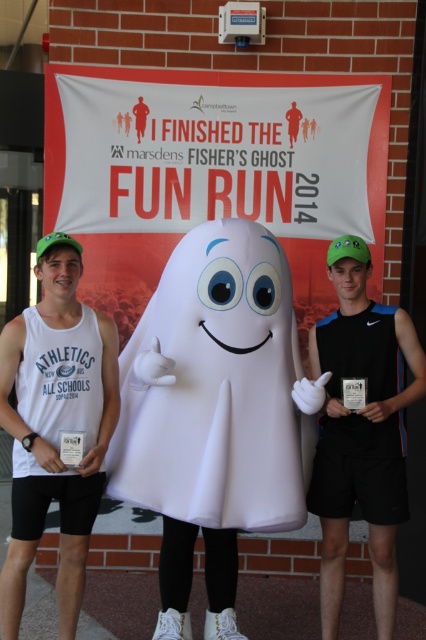
You are a photographer at the event and want to capture a photo of the white fabric ghost at center and the black matte tank top at center without any overlap between them. Given that your camera has a minimum focus distance of 20 inches, can you take the photo while keeping both objects in focus?

The distance between the white fabric ghost at center and the black matte tank top at center is 22.11 inches, which is greater than the camera minimum focus distance of 20 inches. Therefore, yes, you can take the photo while keeping both objects in focus.

You are a photographer at the event and need to ensure all participants are visible in the photo. The white matte tank top at left and the black matte tank top at center are standing side by side. Which participant should move forward to ensure both are equally visible?

The white matte tank top at left should move forward since it has a smaller size compared to the black matte tank top at center, making them appear more balanced in the photo.